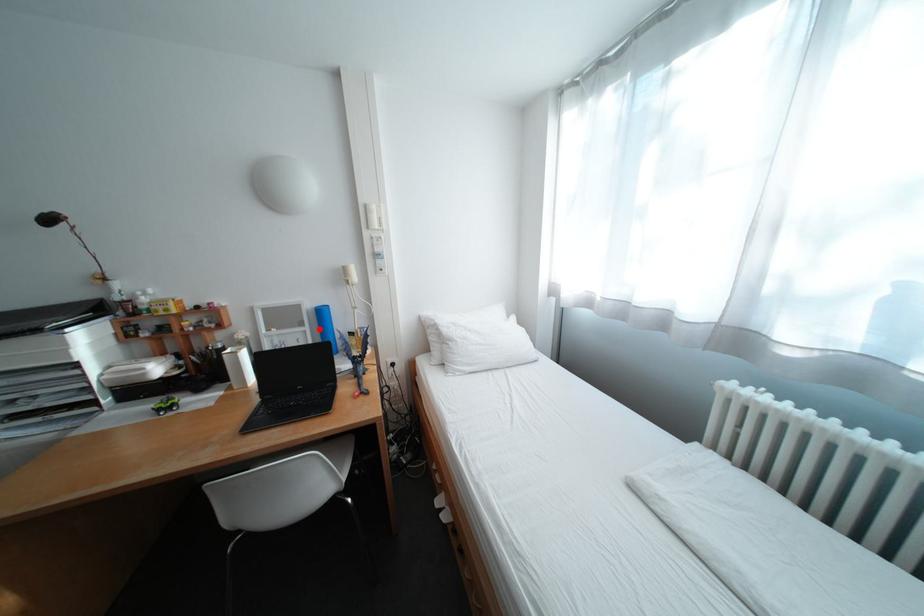
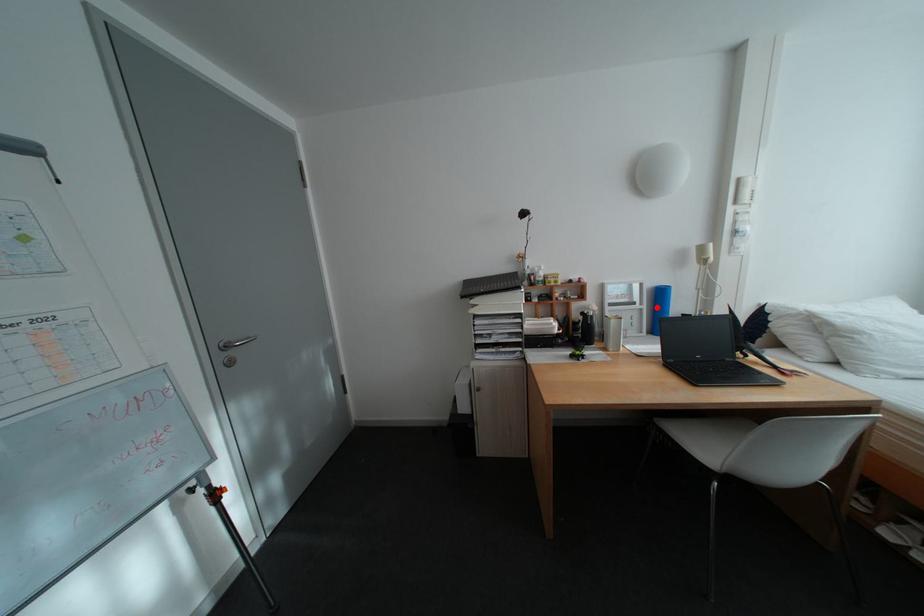
I am providing you with two images of the same scene from different viewpoints. A red point is marked on the first image and another point is marked on the second image. Do the highlighted points in image1 and image2 indicate the same real-world spot?

Yes